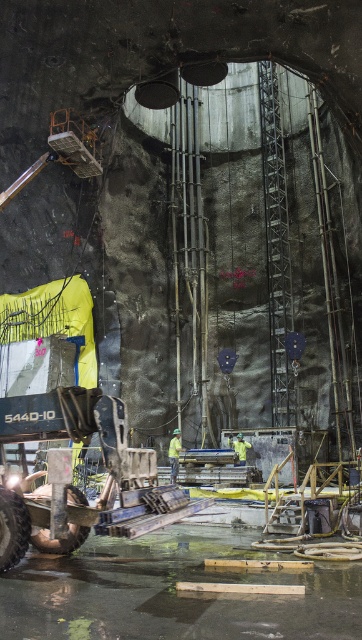
Based on the photo, you are a worker at the construction site and need to move from the point at coordinates point (45,504) to the point at coordinates point (171,477). Which direction should you move to reach your destination?

You should move backward to reach point (171,477) from point (45,504) because point (45,504) is in front of point (171,477).

You are standing at the point labeled as point (48,536) in the construction site. A safety inspector wants to ensure that all workers are at least 10 meters away from this point for safety reasons. Are the workers currently compliant with this requirement?

The point (48,536) and the viewer are 8.69 meters apart, so the workers are not compliant with the requirement as they are closer than the required 10 meters.

You are a safety inspector at the construction site. You notice two points marked in the image. The first point is labeled as point (x=177, y=467) and the second is point (x=229, y=440). From your vantage point, which point is closer to you?

Point (x=177, y=467) is in front of point (x=229, y=440), so it is closer to you.